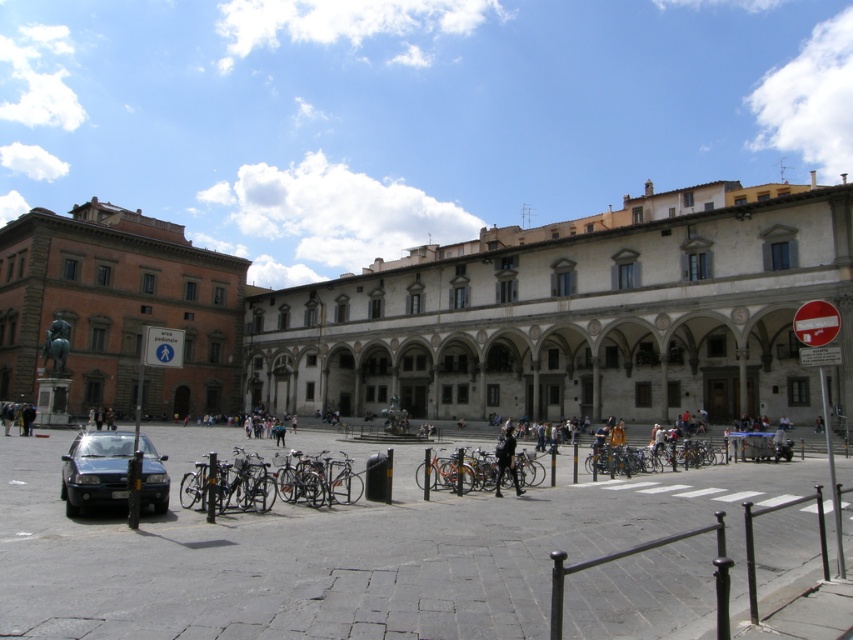
Which is in front, point (846, 369) or point (161, 508)?

Point (161, 508) is in front.

What are the coordinates of `white stone building at center` in the screenshot? It's located at (572, 321).

Where is `white stone building at center`? The image size is (853, 640). white stone building at center is located at coordinates (572, 321).

Is the position of matte brick building at left more distant than that of orange matte bicycle at center?

Yes, it is.

Does matte brick building at left have a lesser height compared to orange matte bicycle at center?

No, matte brick building at left is not shorter than orange matte bicycle at center.

Does point (209, 326) come farther from viewer compared to point (474, 461)?

Yes.

I want to click on matte brick building at left, so (x=119, y=308).

Can you confirm if white stone building at center is smaller than matte brick building at left?

Correct, white stone building at center occupies less space than matte brick building at left.

Who is higher up, white stone building at center or matte brick building at left?

matte brick building at left

The image size is (853, 640). What do you see at coordinates (572, 321) in the screenshot? I see `white stone building at center` at bounding box center [572, 321].

This screenshot has width=853, height=640. What are the coordinates of `white stone building at center` in the screenshot? It's located at (572, 321).